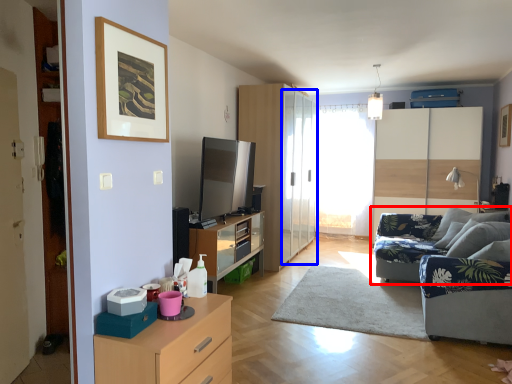
Question: Which object appears farthest to the camera in this image, studio couch (highlighted by a red box) or glass door (highlighted by a blue box)?

Choices:
 (A) studio couch
 (B) glass door

Answer: (B)